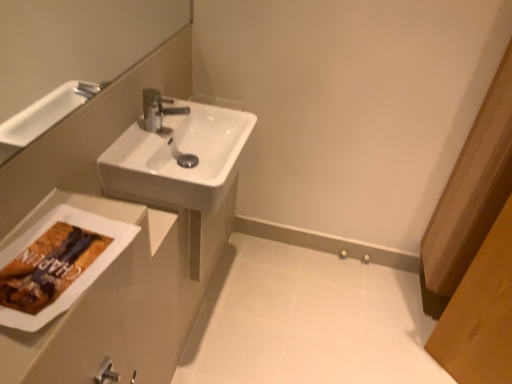
Question: Is white glossy porcelain at center surrounded by white glossy sink at center?

Choices:
 (A) no
 (B) yes

Answer: (A)

Question: Considering the relative positions of white glossy sink at center and white glossy porcelain at center in the image provided, is white glossy sink at center to the left of white glossy porcelain at center from the viewer's perspective?

Choices:
 (A) no
 (B) yes

Answer: (B)

Question: From a real-world perspective, is white glossy sink at center beneath white glossy porcelain at center?

Choices:
 (A) yes
 (B) no

Answer: (B)

Question: Is white glossy sink at center oriented away from white glossy porcelain at center?

Choices:
 (A) yes
 (B) no

Answer: (B)

Question: Does white glossy sink at center have a greater width compared to white glossy porcelain at center?

Choices:
 (A) no
 (B) yes

Answer: (A)

Question: Is white glossy sink at center far away from white glossy porcelain at center?

Choices:
 (A) yes
 (B) no

Answer: (B)

Question: From the image's perspective, is white glossy porcelain at center under white glossy sink at center?

Choices:
 (A) yes
 (B) no

Answer: (A)

Question: Is white glossy porcelain at center positioned in front of white glossy sink at center?

Choices:
 (A) no
 (B) yes

Answer: (A)

Question: From the image's perspective, is white glossy porcelain at center located above white glossy sink at center?

Choices:
 (A) yes
 (B) no

Answer: (B)

Question: Is white glossy porcelain at center to the right of white glossy sink at center from the viewer's perspective?

Choices:
 (A) yes
 (B) no

Answer: (A)

Question: Considering the relative sizes of white glossy porcelain at center and white glossy sink at center in the image provided, is white glossy porcelain at center taller than white glossy sink at center?

Choices:
 (A) yes
 (B) no

Answer: (B)

Question: Would you consider white glossy porcelain at center to be distant from white glossy sink at center?

Choices:
 (A) no
 (B) yes

Answer: (A)

Question: Looking at their shapes, would you say white glossy porcelain at center is wider or thinner than white glossy sink at center?

Choices:
 (A) wide
 (B) thin

Answer: (A)